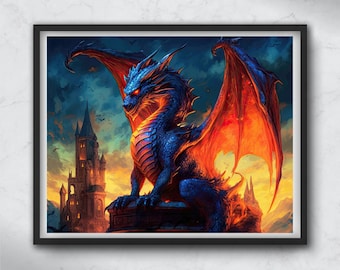
This screenshot has height=270, width=340. In order to click on mat in this screenshot , I will do `click(297, 228)`.